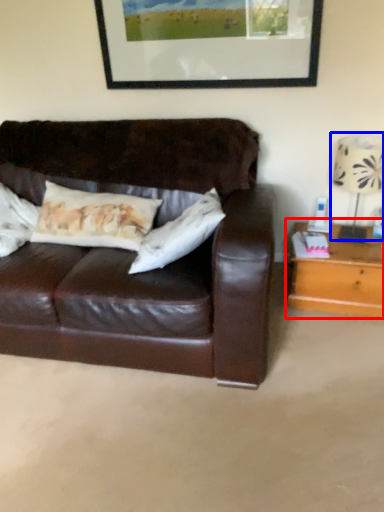
Question: Which point is further to the camera, table (highlighted by a red box) or table lamp (highlighted by a blue box)?

Choices:
 (A) table
 (B) table lamp

Answer: (A)